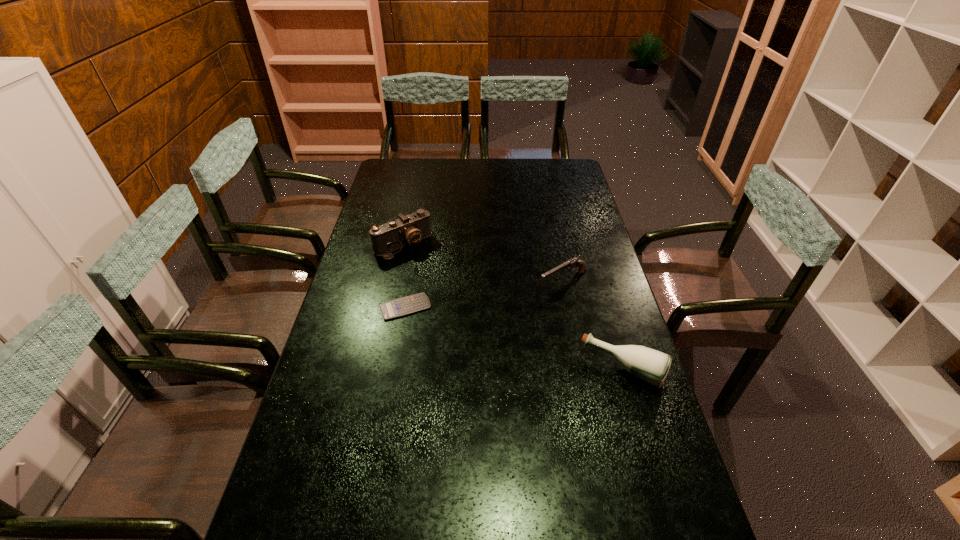
Locate an element on the screen. free space at the far left corner is located at coordinates (387, 161).

This screenshot has height=540, width=960. Identify the location of free space between the gun and the nearest object. (593, 326).

Find the location of `vacant space in between the gun and the bottle`. vacant space in between the gun and the bottle is located at coordinates (593, 326).

Locate an element on the screen. The height and width of the screenshot is (540, 960). blank region between the camera and the calculator is located at coordinates (404, 276).

In order to click on free space between the farthest object and the gun in this screenshot , I will do `click(483, 264)`.

Find the location of a particular element. unoccupied area between the bottle and the gun is located at coordinates (593, 326).

You are a GUI agent. You are given a task and a screenshot of the screen. Output one action in this format:
    pyautogui.click(x=<x>, y=<y>)
    Task: Click on the free space between the gun and the camera
    The width and height of the screenshot is (960, 540).
    Given the screenshot: What is the action you would take?
    pyautogui.click(x=483, y=264)

You are a GUI agent. You are given a task and a screenshot of the screen. Output one action in this format:
    pyautogui.click(x=<x>, y=<y>)
    Task: Click on the free spot between the shortest object and the gun
    
    Given the screenshot: What is the action you would take?
    pyautogui.click(x=484, y=295)

Find the location of a particular element. free space between the gun and the nearest object is located at coordinates (593, 326).

Locate an element on the screen. The height and width of the screenshot is (540, 960). vacant space that is in between the bottle and the shortest object is located at coordinates (515, 338).